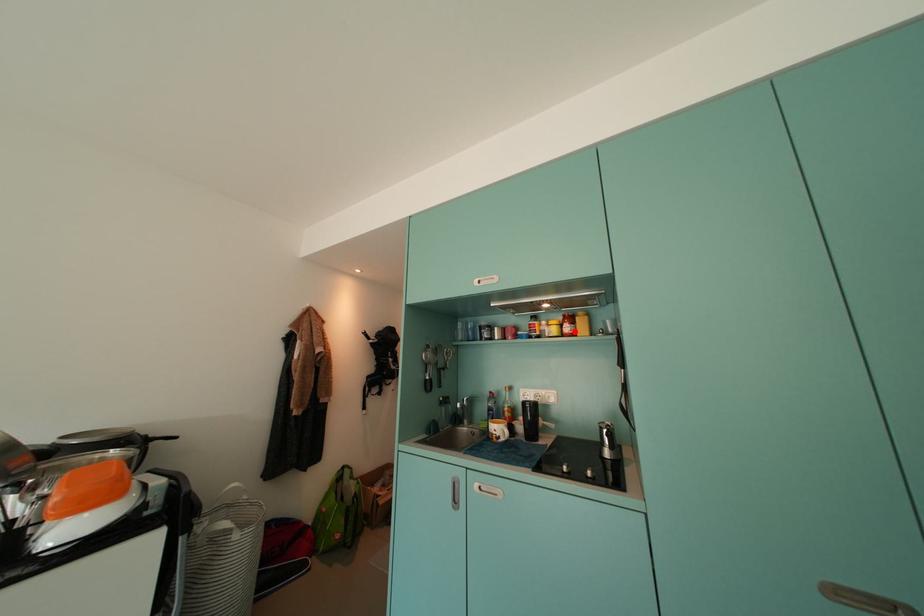
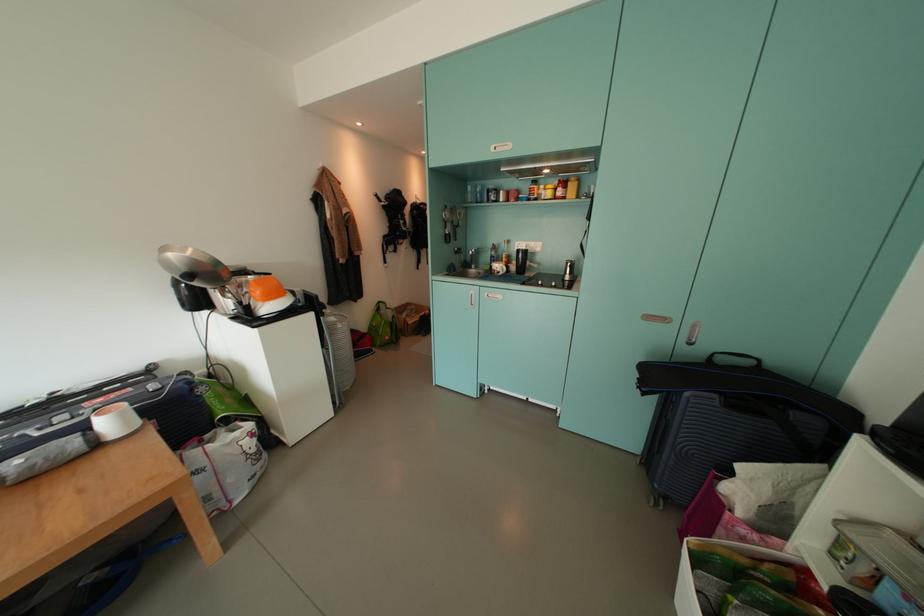
Question: I am providing you with two images of the same scene from different viewpoints. Image1 has a red point marked. In image2, the corresponding 3D location appears at what relative position? Reply with the corresponding letter.

Choices:
 (A) Closer
 (B) Farther

Answer: (A)